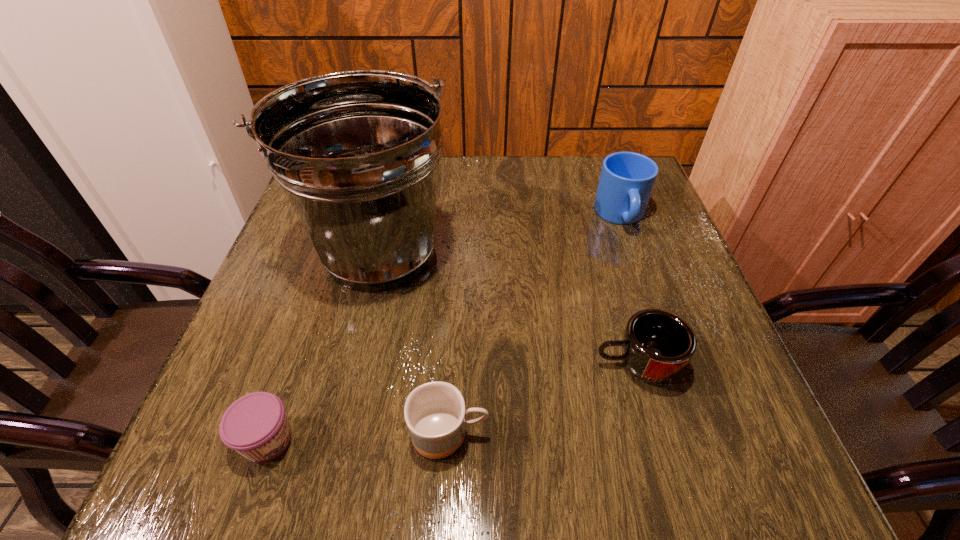
You are a GUI agent. You are given a task and a screenshot of the screen. Output one action in this format:
    pyautogui.click(x=<x>, y=<y>)
    Task: Click on the empty space between the leftmost mug and the bucket
    Image resolution: width=960 pixels, height=540 pixels.
    Given the screenshot: What is the action you would take?
    pyautogui.click(x=413, y=343)

Where is `free space that is in between the farthest mug and the leftmost mug`? free space that is in between the farthest mug and the leftmost mug is located at coordinates (535, 325).

The image size is (960, 540). What are the coordinates of `free area in between the tallest mug and the second farthest mug` in the screenshot? It's located at [629, 290].

Locate an element on the screen. object that is the closest one to the bucket is located at coordinates (435, 414).

You are a GUI agent. You are given a task and a screenshot of the screen. Output one action in this format:
    pyautogui.click(x=<x>, y=<y>)
    Task: Click on the object that is the third closest to the farthest mug
    
    Given the screenshot: What is the action you would take?
    [435, 414]

Locate which mug ranks second in proximity to the third farthest object. Please provide its 2D coordinates. Your answer should be formatted as a tuple, i.e. [(x, y)], where the tuple contains the x and y coordinates of a point satisfying the conditions above.

[(627, 179)]

What are the coordinates of `the closest mug to the fourth shortest object` in the screenshot? It's located at (657, 344).

What are the coordinates of `free location that satisfies the following two spatial constraints: 1. on the side of the second tallest object with the handle; 2. on the side of the second nearest mug with the handle` in the screenshot? It's located at (674, 364).